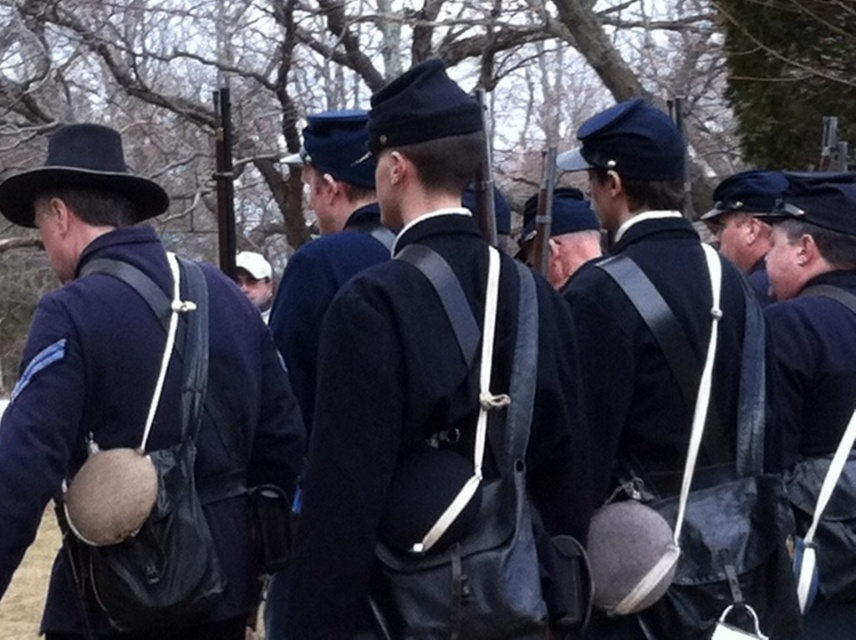
In the historical military scene, there are two head coverings visible. The first is a matte black hat at upper left and the second is a white fabric cap at center. Which of these two head coverings is bigger in size?

The matte black hat at upper left is larger in size compared to the white fabric cap at center.

You are a photographer setting up a shot of the historical reenactment. You notice the matte black hat at upper left and the white fabric cap at center. Which object should you focus on first if you want to capture both in the same frame without moving the camera?

The matte black hat at upper left is located below the white fabric cap at center, so focusing on the white fabric cap at center first would ensure both objects are within the frame since it is higher up.